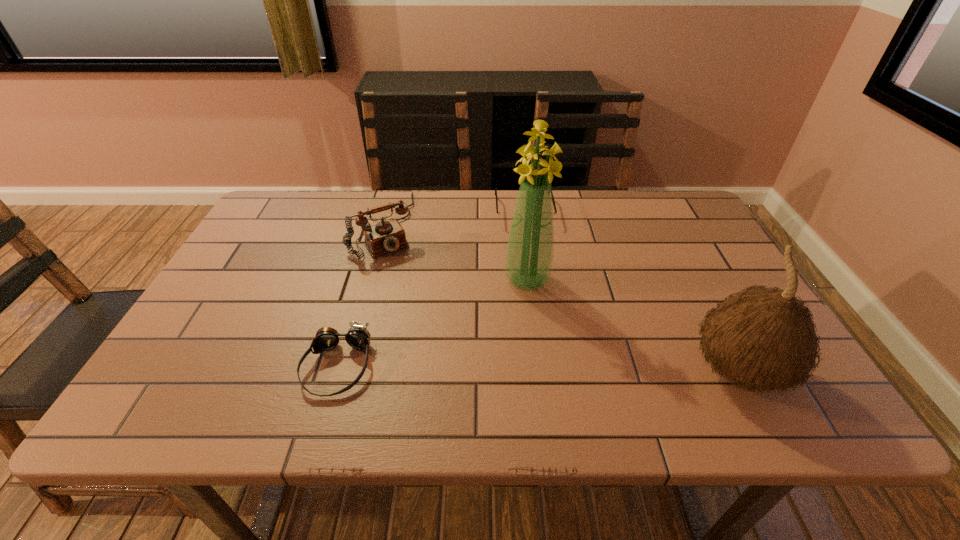
Where is `the closest object relative to the third nearest object`? This screenshot has width=960, height=540. the closest object relative to the third nearest object is located at coordinates (505, 217).

You are a GUI agent. You are given a task and a screenshot of the screen. Output one action in this format:
    pyautogui.click(x=<x>, y=<y>)
    Task: Click on the vacant area in the image that satisfies the following two spatial constraints: 1. through the lenses of the rightmost object; 2. on the surface of the goggles
    
    Given the screenshot: What is the action you would take?
    pyautogui.click(x=335, y=372)

You are a GUI agent. You are given a task and a screenshot of the screen. Output one action in this format:
    pyautogui.click(x=<x>, y=<y>)
    Task: Click on the free space that satisfies the following two spatial constraints: 1. through the lenses of the goggles; 2. on the surface of the coconut
    The width and height of the screenshot is (960, 540).
    Given the screenshot: What is the action you would take?
    pyautogui.click(x=335, y=372)